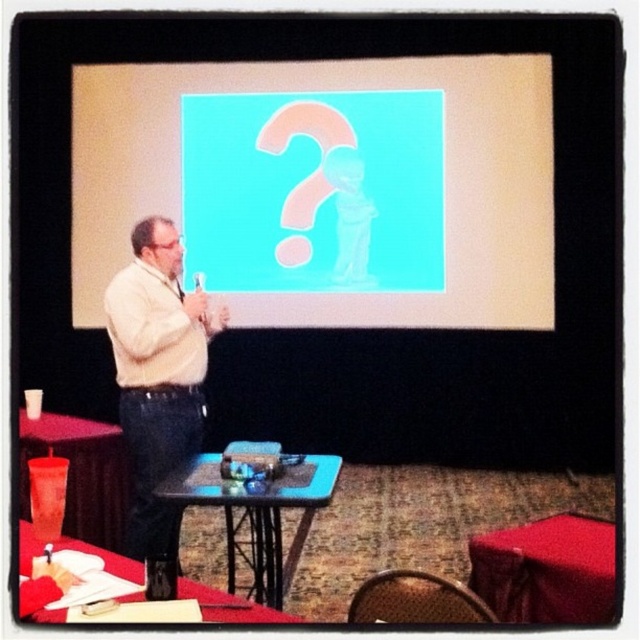
Is point (176, 435) more distant than point (584, 582)?

Yes, it is behind point (584, 582).

Identify the location of beige sweater at center. (157, 378).

Image resolution: width=640 pixels, height=640 pixels. What do you see at coordinates (157, 378) in the screenshot? I see `beige sweater at center` at bounding box center [157, 378].

Locate an element on the screen. beige sweater at center is located at coordinates (157, 378).

Is point (541, 532) positioned after point (49, 448)?

That is False.

Between point (497, 573) and point (115, 544), which one is positioned in front?

Point (497, 573)

What do you see at coordinates (547, 570) in the screenshot? I see `red fabric table at lower right` at bounding box center [547, 570].

Where is `red fabric table at lower right`? Image resolution: width=640 pixels, height=640 pixels. red fabric table at lower right is located at coordinates (547, 570).

Which is more to the left, blue plastic table at center or red plastic table at lower left?

red plastic table at lower left

What do you see at coordinates (256, 512) in the screenshot? The image size is (640, 640). I see `blue plastic table at center` at bounding box center [256, 512].

The image size is (640, 640). Identify the location of blue plastic table at center. (256, 512).